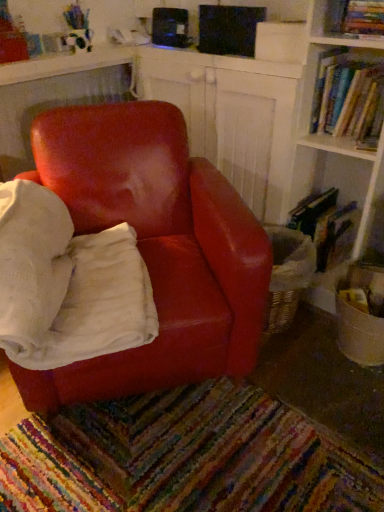
Question: Is hardcover book at right, acting as the 3th book starting from the top, turned away from hardcover book at upper right, the third book in the bottom-to-top sequence?

Choices:
 (A) yes
 (B) no

Answer: (B)

Question: Could hardcover book at upper right, the 1th book in the top-to-bottom sequence, be considered to be inside hardcover book at right, acting as the 3th book starting from the top?

Choices:
 (A) yes
 (B) no

Answer: (B)

Question: Considering the relative sizes of hardcover book at right, marked as the 1th book in a bottom-to-top arrangement, and hardcover book at upper right, the third book in the bottom-to-top sequence, in the image provided, is hardcover book at right, marked as the 1th book in a bottom-to-top arrangement, smaller than hardcover book at upper right, the third book in the bottom-to-top sequence,?

Choices:
 (A) no
 (B) yes

Answer: (A)

Question: Is hardcover book at right, marked as the 1th book in a bottom-to-top arrangement, located outside hardcover book at upper right, the third book in the bottom-to-top sequence?

Choices:
 (A) yes
 (B) no

Answer: (A)

Question: Considering the relative sizes of hardcover book at right, marked as the 1th book in a bottom-to-top arrangement, and hardcover book at upper right, the third book in the bottom-to-top sequence, in the image provided, is hardcover book at right, marked as the 1th book in a bottom-to-top arrangement, bigger than hardcover book at upper right, the third book in the bottom-to-top sequence,?

Choices:
 (A) yes
 (B) no

Answer: (A)

Question: Does hardcover book at right, acting as the 3th book starting from the top, have a greater height compared to hardcover book at upper right, the 1th book in the top-to-bottom sequence?

Choices:
 (A) no
 (B) yes

Answer: (B)

Question: From a real-world perspective, is matte leather chair at center on top of hardcover book at upper right, the 1th book in the top-to-bottom sequence?

Choices:
 (A) yes
 (B) no

Answer: (B)

Question: From a real-world perspective, is matte leather chair at center positioned under hardcover book at upper right, the third book in the bottom-to-top sequence, based on gravity?

Choices:
 (A) yes
 (B) no

Answer: (A)

Question: Is hardcover book at upper right, the 1th book in the top-to-bottom sequence, a part of matte leather chair at center?

Choices:
 (A) yes
 (B) no

Answer: (B)

Question: Can you confirm if matte leather chair at center is smaller than hardcover book at upper right, the 1th book in the top-to-bottom sequence?

Choices:
 (A) yes
 (B) no

Answer: (B)

Question: Can you confirm if matte leather chair at center is wider than hardcover book at upper right, the third book in the bottom-to-top sequence?

Choices:
 (A) no
 (B) yes

Answer: (B)

Question: Is matte leather chair at center outside hardcover book at upper right, the 1th book in the top-to-bottom sequence?

Choices:
 (A) yes
 (B) no

Answer: (A)

Question: Is hardcover books at upper right, positioned as the 2th book in bottom-to-top order, far from hardcover book at upper right, the 1th book in the top-to-bottom sequence?

Choices:
 (A) no
 (B) yes

Answer: (A)